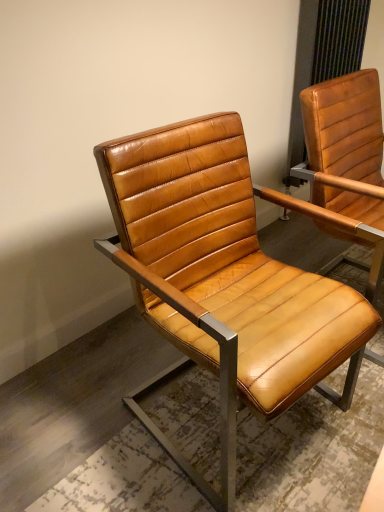
Question: Relative to cognac leather chair at center, which ranks as the first chair in left-to-right order, is matte leather chair at right, which is the 1th chair in right-to-left order, in front or behind?

Choices:
 (A) front
 (B) behind

Answer: (B)

Question: From a real-world perspective, relative to cognac leather chair at center, positioned as the 2th chair in right-to-left order, is matte leather chair at right, placed as the second chair when sorted from left to right, vertically above or below?

Choices:
 (A) above
 (B) below

Answer: (A)

Question: Considering the positions of point (365, 162) and point (119, 180), is point (365, 162) closer or farther from the camera than point (119, 180)?

Choices:
 (A) closer
 (B) farther

Answer: (B)

Question: From the image's perspective, is cognac leather chair at center, positioned as the 2th chair in right-to-left order, positioned above or below matte leather chair at right, which is the 1th chair in right-to-left order?

Choices:
 (A) above
 (B) below

Answer: (B)

Question: Is cognac leather chair at center, positioned as the 2th chair in right-to-left order, in front of or behind matte leather chair at right, placed as the second chair when sorted from left to right, in the image?

Choices:
 (A) front
 (B) behind

Answer: (A)

Question: From a real-world perspective, is cognac leather chair at center, which ranks as the first chair in left-to-right order, above or below matte leather chair at right, placed as the second chair when sorted from left to right?

Choices:
 (A) below
 (B) above

Answer: (A)

Question: Is cognac leather chair at center, which ranks as the first chair in left-to-right order, taller or shorter than matte leather chair at right, which is the 1th chair in right-to-left order?

Choices:
 (A) short
 (B) tall

Answer: (A)